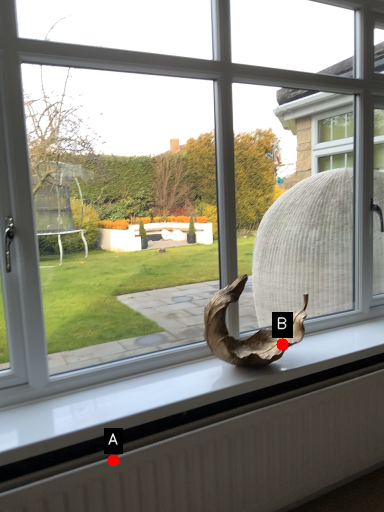
Question: Two points are circled on the image, labeled by A and B beside each circle. Which of the following is the closest to the observer?

Choices:
 (A) A is closer
 (B) B is closer

Answer: (A)